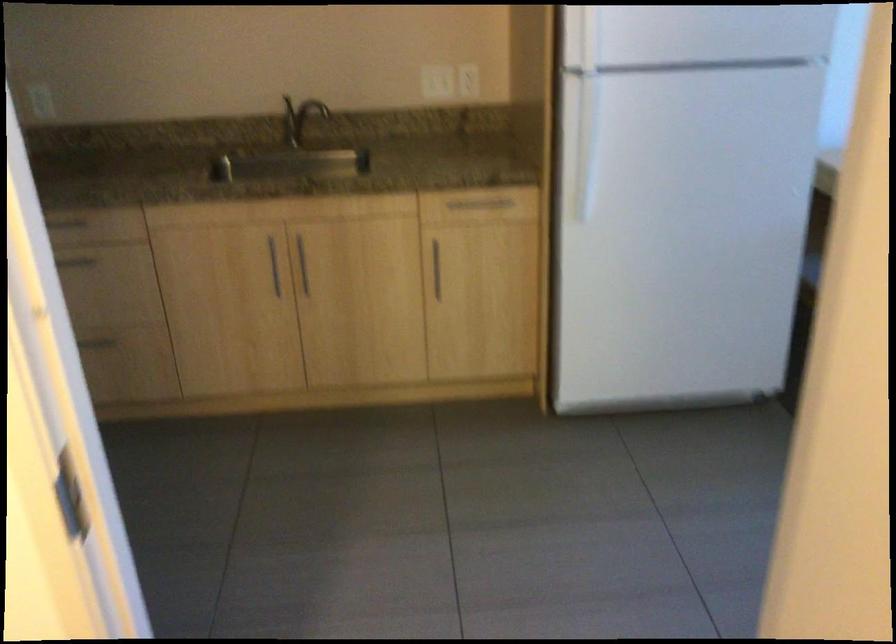
Identify the location of faucet handle. (299, 118).